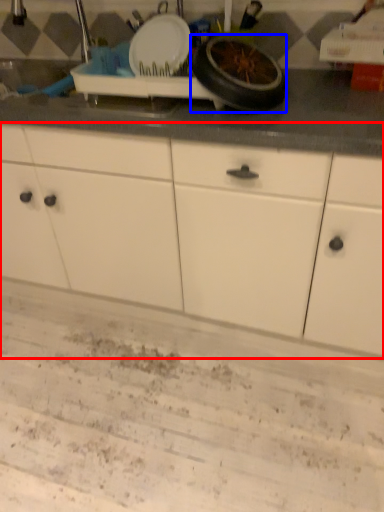
Question: Which of the following is the farthest to the observer, cabinetry (highlighted by a red box) or wheel (highlighted by a blue box)?

Choices:
 (A) cabinetry
 (B) wheel

Answer: (B)